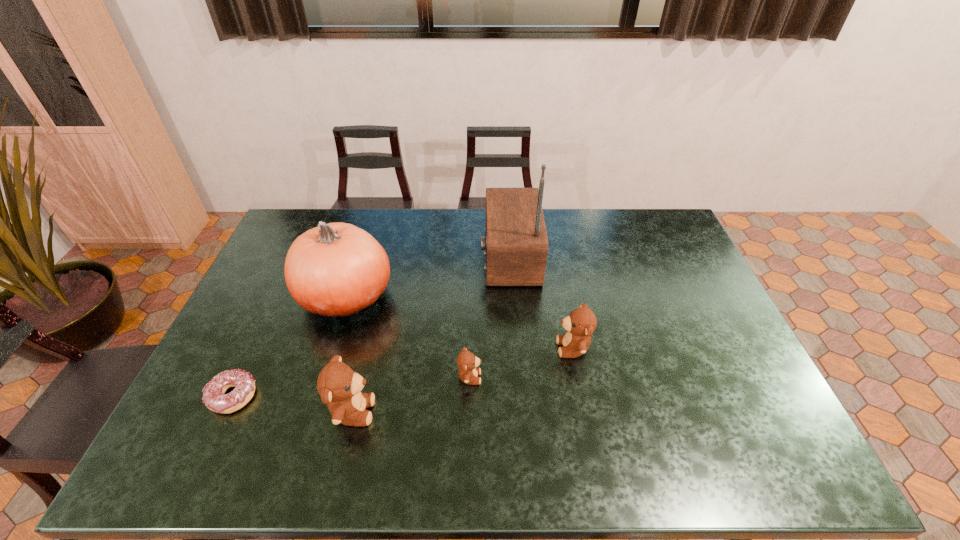
Locate an element on the screen. the leftmost teddy bear is located at coordinates (339, 386).

The width and height of the screenshot is (960, 540). I want to click on the second shortest object, so click(x=467, y=362).

At what (x,y) coordinates should I click in order to perform the action: click on the second teddy bear from left to right. Please return your answer as a coordinate pair (x, y). The width and height of the screenshot is (960, 540). Looking at the image, I should click on (467, 362).

Find the location of a particular element. This screenshot has height=540, width=960. the rightmost object is located at coordinates (581, 323).

What are the coordinates of `the fourth tallest object` in the screenshot? It's located at (581, 323).

Identify the location of radio receiver. click(x=516, y=244).

This screenshot has height=540, width=960. I want to click on pumpkin, so click(x=337, y=269).

What are the coordinates of `doughnut` in the screenshot? It's located at (214, 397).

Find the location of `free region located on the face of the leftmost teddy bear`. free region located on the face of the leftmost teddy bear is located at coordinates (419, 411).

You are a GUI agent. You are given a task and a screenshot of the screen. Output one action in this format:
    pyautogui.click(x=<x>, y=<y>)
    Task: Click on the vacant region located on the face of the second shortest object
    Image resolution: width=960 pixels, height=540 pixels.
    Given the screenshot: What is the action you would take?
    pyautogui.click(x=538, y=377)